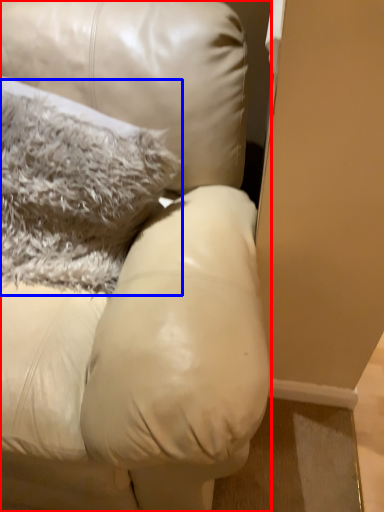
Question: Which point is closer to the camera, furniture (highlighted by a red box) or pillow (highlighted by a blue box)?

Choices:
 (A) furniture
 (B) pillow

Answer: (A)